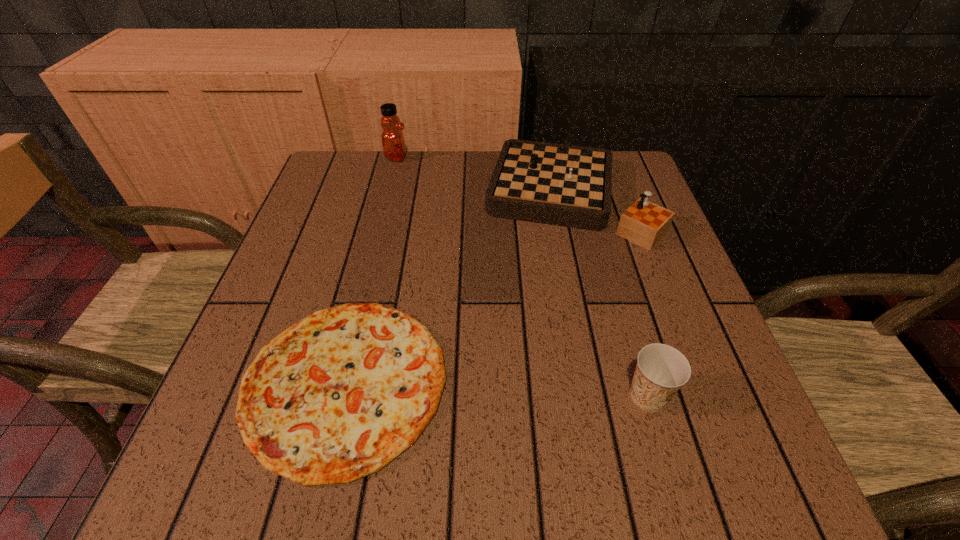
Locate an element on the screen. The height and width of the screenshot is (540, 960). object that is at the near edge is located at coordinates (337, 396).

Image resolution: width=960 pixels, height=540 pixels. Identify the location of honey that is at the left edge. (393, 142).

The height and width of the screenshot is (540, 960). Find the location of `pizza situated at the left edge`. pizza situated at the left edge is located at coordinates (337, 396).

At what (x,y) coordinates should I click in order to perform the action: click on chessboard that is at the right edge. Please return your answer as a coordinate pair (x, y). The width and height of the screenshot is (960, 540). Looking at the image, I should click on (566, 185).

Locate an element on the screen. This screenshot has width=960, height=540. Dixie cup that is at the right edge is located at coordinates (661, 370).

Where is `object at the far left corner`? object at the far left corner is located at coordinates (393, 142).

Where is `object at the near left corner`? Image resolution: width=960 pixels, height=540 pixels. object at the near left corner is located at coordinates (337, 396).

Find the location of `object that is at the far right corner`. object that is at the far right corner is located at coordinates (x=566, y=185).

This screenshot has height=540, width=960. Find the location of `free space at the far edge of the desktop`. free space at the far edge of the desktop is located at coordinates (417, 192).

You are a GUI agent. You are given a task and a screenshot of the screen. Output one action in this format:
    pyautogui.click(x=<x>, y=<y>)
    Task: Click on the vacant space at the left edge
    The height and width of the screenshot is (540, 960).
    Given the screenshot: What is the action you would take?
    pyautogui.click(x=264, y=325)